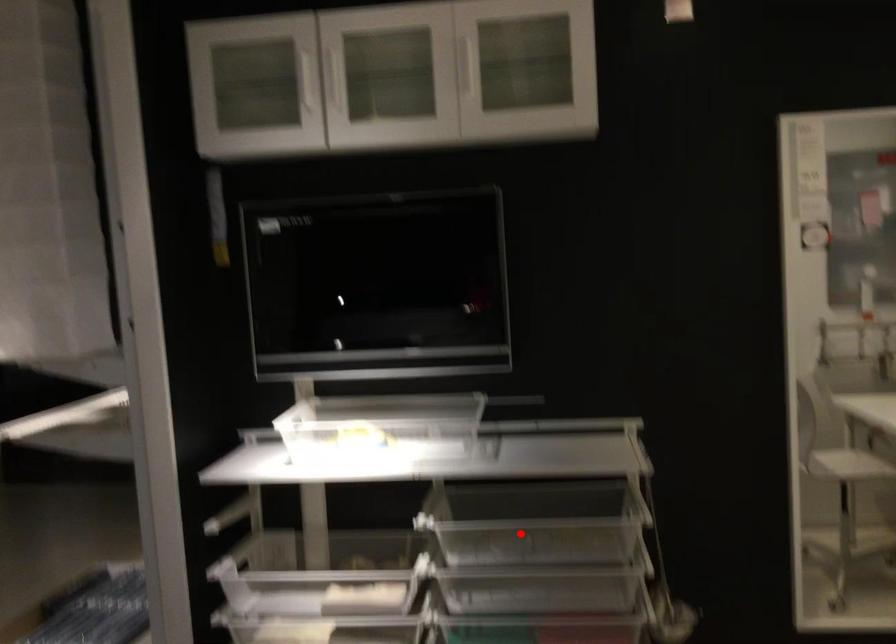
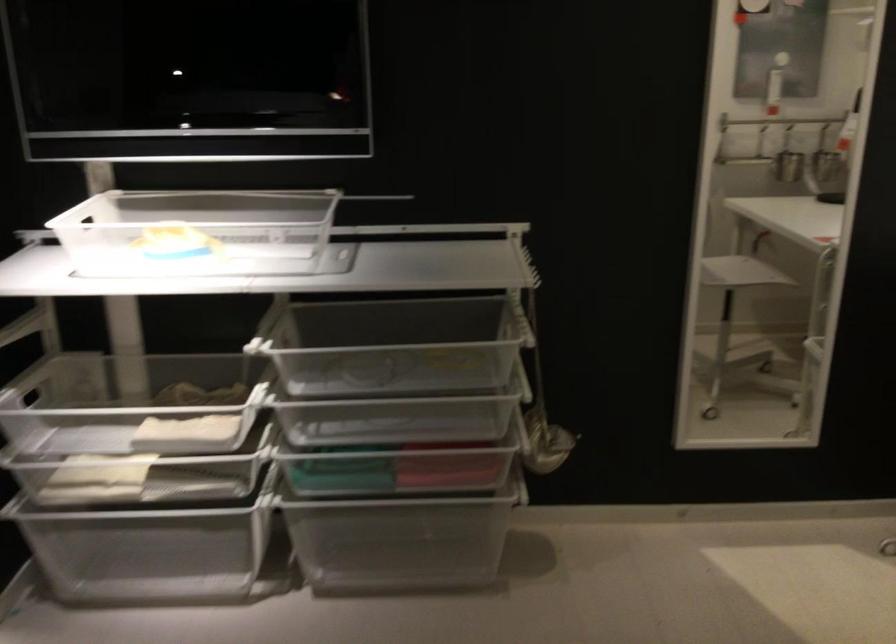
The point at the highlighted location is marked in the first image. Where is the corresponding point in the second image?

(382, 357)